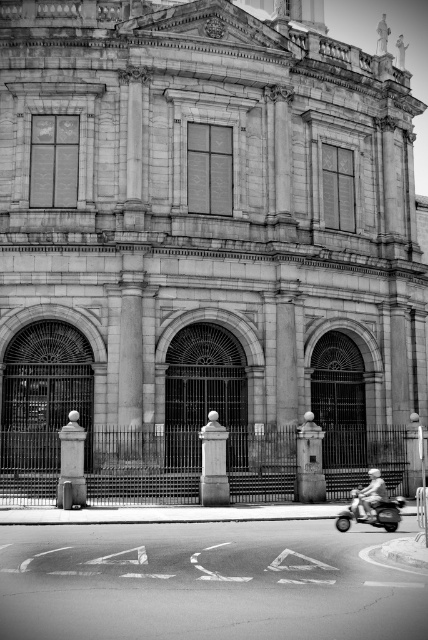
You are standing in front of the grand classical building and notice two points marked on the metal fence. The first point is at coordinate point(338, 518) and the second is at point(382, 483). Which point is closer to you?

Point(338, 518) is closer to the viewer than point(382, 483).

You are a delivery person standing on the sidewalk in front of the grand classical building. You need to park your shiny metallic motorcycle at lower right. Where should you position it relative to the fence and the building?

The shiny metallic motorcycle at lower right should be positioned at coordinates point (371, 513), which is near the lower right corner of the building and close to the fence, ensuring it stays within the designated parking area.

Looking at this image, you are standing at the camera position and want to take a photo of the shiny metallic motorcycle at lower right. The camera has a maximum zoom range of 100 feet. Can you capture the motorcycle in your photo without moving closer?

The shiny metallic motorcycle at lower right and camera are 142.59 feet apart from each other, which exceeds the camera maximum zoom range of 100 feet. Therefore, you cannot capture the motorcycle in your photo without moving closer.